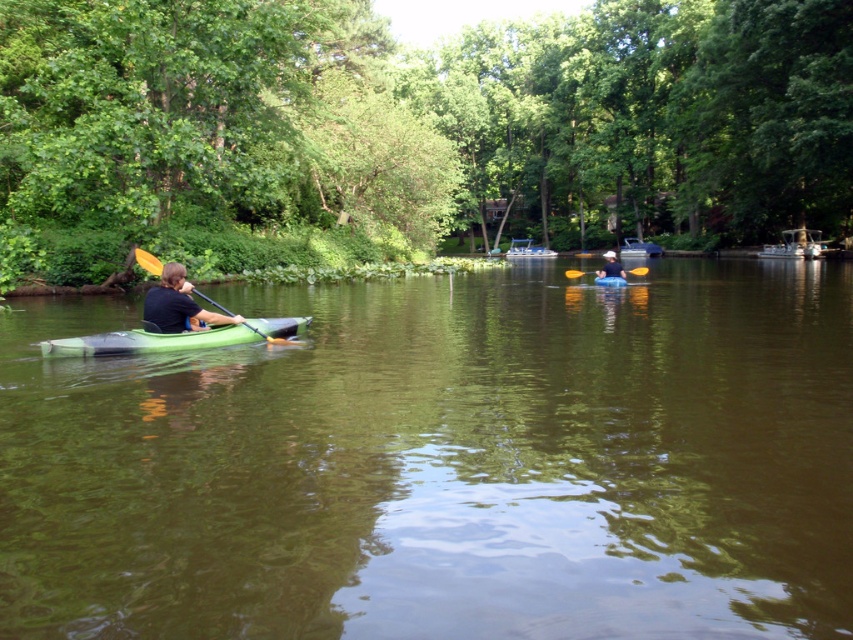
You are standing on the riverbank and see two points on the water surface, point (172, 273) and point (144, 260). Which point is nearer to you?

Point (172, 273) is closer to the viewer than point (144, 260), so the point (172, 273) is nearer to you.

You are planning to take a photo of the green rubber kayak at left and the yellow wood paddle at left. Since you want to capture both objects clearly in the frame, which object should you focus on to ensure proper depth of field?

You should focus on the green rubber kayak at left because it is larger in size compared to the yellow wood paddle at left, ensuring both are in focus.

You are a drone operator trying to capture a photo of the green matte kayak at left. The drone is currently hovering at the point with coordinates point (x=148, y=340). Will the drone be able to capture the kayak in the photo if it takes the picture from this position?

The point (x=148, y=340) is on the green matte kayak at left, so yes, the drone will be able to capture the kayak in the photo from this position.